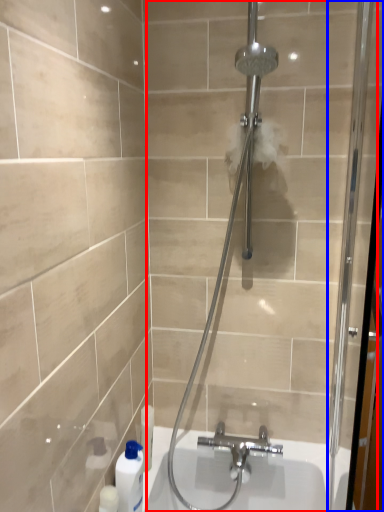
Question: Which of the following is the farthest to the observer, shower door (highlighted by a red box) or screen door (highlighted by a blue box)?

Choices:
 (A) shower door
 (B) screen door

Answer: (A)